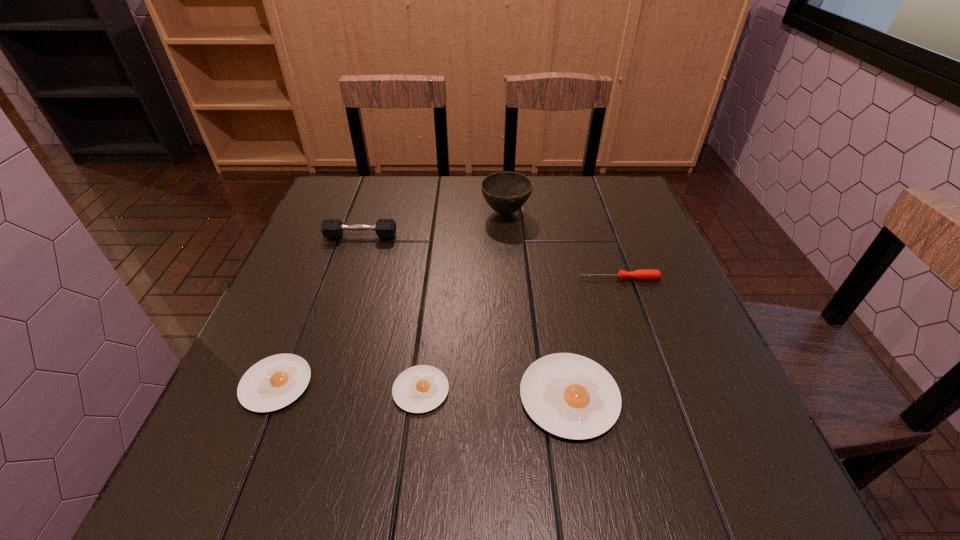
You are a GUI agent. You are given a task and a screenshot of the screen. Output one action in this format:
    pyautogui.click(x=<x>, y=<y>)
    Task: Click on the free space at the near right corner of the desktop
    The image size is (960, 540).
    Given the screenshot: What is the action you would take?
    pyautogui.click(x=654, y=392)

Where is `free space between the fifth nearest object and the farthest object`? The height and width of the screenshot is (540, 960). free space between the fifth nearest object and the farthest object is located at coordinates (433, 225).

The width and height of the screenshot is (960, 540). I want to click on empty location between the dumbbell and the leftmost egg yolk, so pos(319,310).

Locate an element on the screen. The width and height of the screenshot is (960, 540). vacant area that lies between the second tallest egg yolk and the fourth nearest object is located at coordinates (447, 332).

This screenshot has height=540, width=960. What are the coordinates of `empty space between the second shortest egg yolk and the fifth nearest object` in the screenshot? It's located at (319, 310).

The image size is (960, 540). I want to click on free space that is in between the shortest object and the dumbbell, so click(391, 313).

This screenshot has width=960, height=540. I want to click on free spot between the dumbbell and the farthest object, so click(x=433, y=225).

Image resolution: width=960 pixels, height=540 pixels. I want to click on free spot between the leftmost egg yolk and the screwdriver, so click(x=447, y=332).

The width and height of the screenshot is (960, 540). What are the coordinates of `empty location between the second tallest egg yolk and the fifth shortest object` in the screenshot? It's located at (319, 310).

Find the location of a particular element. This screenshot has width=960, height=540. unoccupied position between the shortest egg yolk and the fifth tallest object is located at coordinates (348, 387).